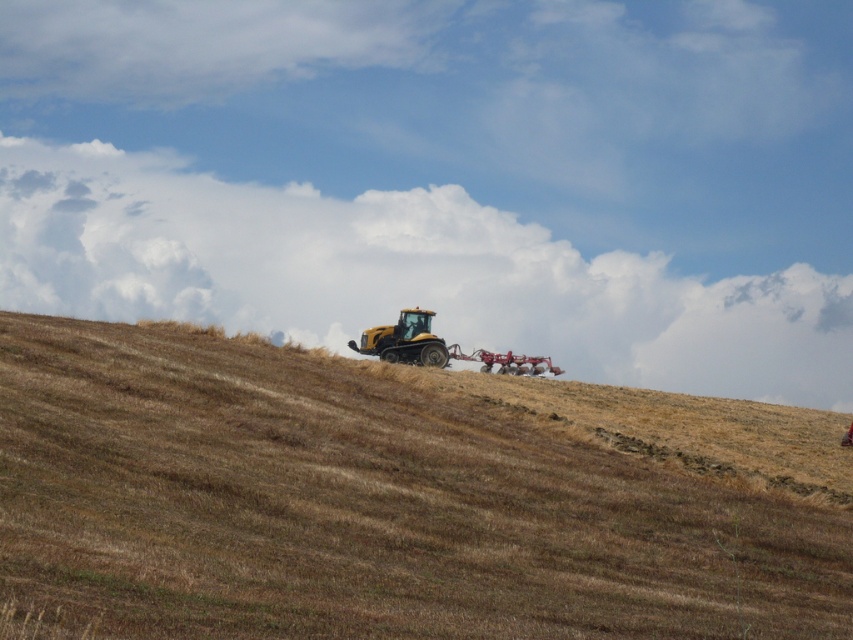
You are a farmer standing on the yellow matte tractor at center and want to move to the brown grassy hillside at center. Which direction should you drive the tractor to reach the hillside?

The brown grassy hillside at center is to the right of the yellow matte tractor at center, so you should drive the tractor to the right to reach the hillside.

You are a farmer standing on the brown grassy hillside at center. You want to move your yellow matte tractor at center to a safer spot uphill to avoid potential flooding. Can you move it uphill from its current position?

The brown grassy hillside at center is positioned under the yellow matte tractor at center, which means the tractor is currently on top of the hillside. To move it uphill, you would need to drive it away from the hillside towards higher ground. However, since the tractor is already on the hillside, you might need to assess the slope direction and ensure the path uphill is accessible.

You are standing at the top of the slope in the rural landscape. You see two points marked on the slope. Which point is closer to you, point (550, 620) or point (430, 336)?

Point (430, 336) is closer to you because it is behind point (550, 620), which is in front of it. Since you are at the top of the slope, the point in front would be farther away from you.